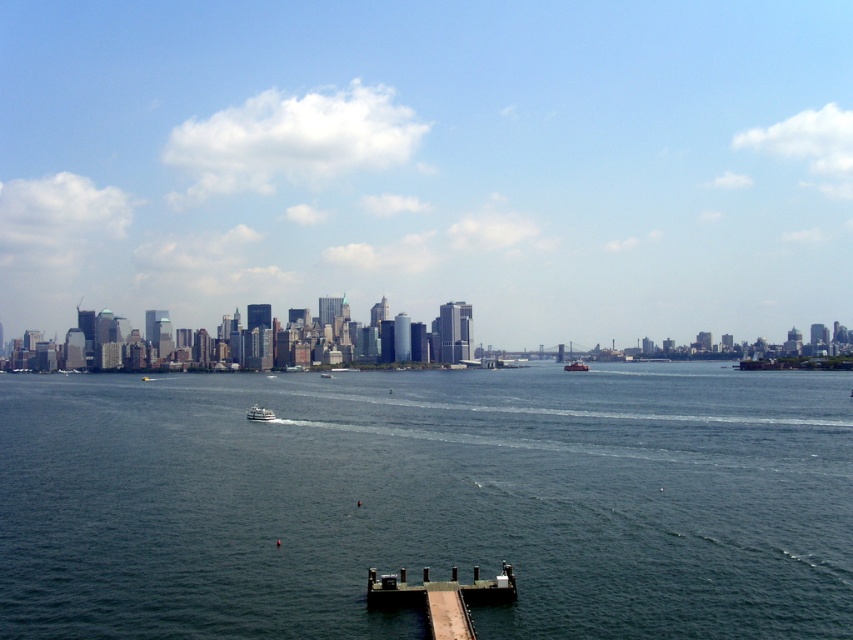
Question: Based on their relative distances, which object is nearer to the metallic gray ship at center?

Choices:
 (A) brown wooden dock at lower center
 (B) white glossy ferry at center

Answer: (B)

Question: Estimate the real-world distances between objects in this image. Which object is farther from the metallic gray ship at center?

Choices:
 (A) white glossy ferry at center
 (B) brown wooden dock at lower center
 (C) dark blue water at center

Answer: (B)

Question: Which of these objects is positioned closest to the brown wooden dock at lower center?

Choices:
 (A) metallic gray ship at center
 (B) white glossy ferry at center

Answer: (B)

Question: Is white glossy ferry at center closer to the viewer compared to metallic gray ship at center?

Choices:
 (A) no
 (B) yes

Answer: (B)

Question: Observing the image, what is the correct spatial positioning of white glossy ferry at center in reference to metallic gray ship at center?

Choices:
 (A) above
 (B) below

Answer: (B)

Question: Does dark blue water at center appear on the left side of metallic gray ship at center?

Choices:
 (A) no
 (B) yes

Answer: (B)